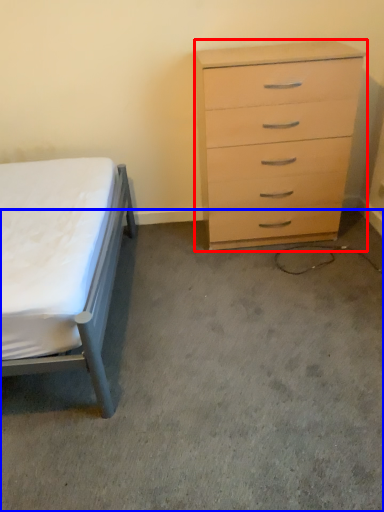
Question: Which point is closer to the camera, chest of drawers (highlighted by a red box) or concrete (highlighted by a blue box)?

Choices:
 (A) chest of drawers
 (B) concrete

Answer: (B)